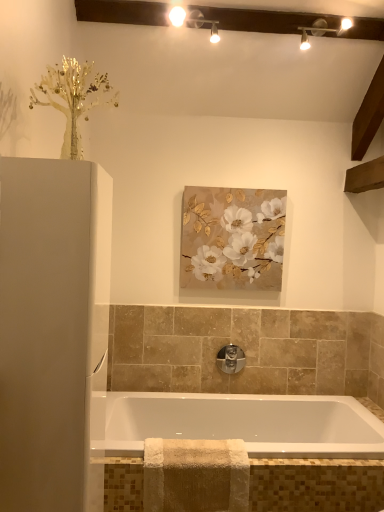
Question: Is satin nickel faucet at center facing away from matte gold and white floral painting at center?

Choices:
 (A) yes
 (B) no

Answer: (B)

Question: Is satin nickel faucet at center positioned behind matte gold and white floral painting at center?

Choices:
 (A) yes
 (B) no

Answer: (A)

Question: Considering the relative sizes of satin nickel faucet at center and matte gold and white floral painting at center in the image provided, is satin nickel faucet at center bigger than matte gold and white floral painting at center?

Choices:
 (A) no
 (B) yes

Answer: (A)

Question: Is satin nickel faucet at center in contact with matte gold and white floral painting at center?

Choices:
 (A) yes
 (B) no

Answer: (B)

Question: Is satin nickel faucet at center shorter than matte gold and white floral painting at center?

Choices:
 (A) yes
 (B) no

Answer: (A)

Question: From their relative heights in the image, would you say matte white track lights at upper center is taller or shorter than white glossy cabinet at left?

Choices:
 (A) tall
 (B) short

Answer: (B)

Question: In the image, is matte white track lights at upper center positioned in front of or behind white glossy cabinet at left?

Choices:
 (A) behind
 (B) front

Answer: (A)

Question: In terms of size, does matte white track lights at upper center appear bigger or smaller than white glossy cabinet at left?

Choices:
 (A) big
 (B) small

Answer: (B)

Question: In terms of width, does matte white track lights at upper center look wider or thinner when compared to white glossy cabinet at left?

Choices:
 (A) thin
 (B) wide

Answer: (A)

Question: Is beige textured towel at lower center bigger or smaller than satin nickel faucet at center?

Choices:
 (A) big
 (B) small

Answer: (A)

Question: In terms of height, does beige textured towel at lower center look taller or shorter compared to satin nickel faucet at center?

Choices:
 (A) tall
 (B) short

Answer: (A)

Question: From the image's perspective, is beige textured towel at lower center above or below satin nickel faucet at center?

Choices:
 (A) above
 (B) below

Answer: (B)

Question: Does point (210, 466) appear closer or farther from the camera than point (221, 364)?

Choices:
 (A) farther
 (B) closer

Answer: (B)

Question: Considering the positions of point (238, 366) and point (91, 323), is point (238, 366) closer or farther from the camera than point (91, 323)?

Choices:
 (A) closer
 (B) farther

Answer: (B)

Question: Relative to white glossy cabinet at left, is satin nickel faucet at center in front or behind?

Choices:
 (A) behind
 (B) front

Answer: (A)